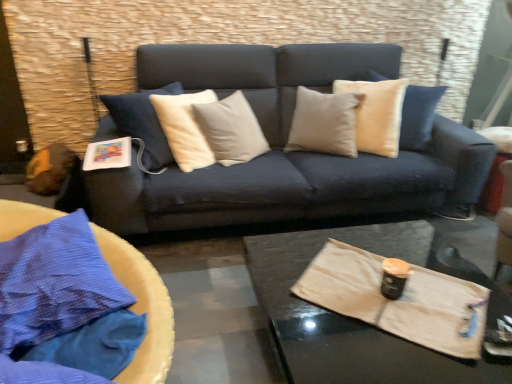
Question: Is blue fabric at left far away from black matte can at center?

Choices:
 (A) no
 (B) yes

Answer: (A)

Question: Is blue fabric at left positioned in front of black matte can at center?

Choices:
 (A) no
 (B) yes

Answer: (B)

Question: From the image's perspective, is blue fabric at left located beneath black matte can at center?

Choices:
 (A) yes
 (B) no

Answer: (B)

Question: Considering the relative positions of blue fabric at left and black matte can at center in the image provided, is blue fabric at left to the right of black matte can at center from the viewer's perspective?

Choices:
 (A) no
 (B) yes

Answer: (A)

Question: Is blue fabric at left taller than black matte can at center?

Choices:
 (A) yes
 (B) no

Answer: (A)

Question: From the image's perspective, is blue fabric at left positioned above or below black matte can at center?

Choices:
 (A) above
 (B) below

Answer: (A)

Question: In terms of height, does blue fabric at left look taller or shorter compared to black matte can at center?

Choices:
 (A) short
 (B) tall

Answer: (B)

Question: In the image, is blue fabric at left on the left side or the right side of black matte can at center?

Choices:
 (A) left
 (B) right

Answer: (A)

Question: Looking at the image, does blue fabric at left seem bigger or smaller compared to black matte can at center?

Choices:
 (A) small
 (B) big

Answer: (B)

Question: From their relative heights in the image, would you say blue fabric at left is taller or shorter than wooden tray at center?

Choices:
 (A) tall
 (B) short

Answer: (A)

Question: From the image's perspective, is blue fabric at left located above or below wooden tray at center?

Choices:
 (A) above
 (B) below

Answer: (A)

Question: In terms of size, does blue fabric at left appear bigger or smaller than wooden tray at center?

Choices:
 (A) small
 (B) big

Answer: (A)

Question: Does point (2, 228) appear closer or farther from the camera than point (391, 228)?

Choices:
 (A) closer
 (B) farther

Answer: (A)

Question: Is wooden tray at center taller or shorter than black matte can at center?

Choices:
 (A) short
 (B) tall

Answer: (B)

Question: Based on their positions, is wooden tray at center located to the left or right of black matte can at center?

Choices:
 (A) left
 (B) right

Answer: (A)